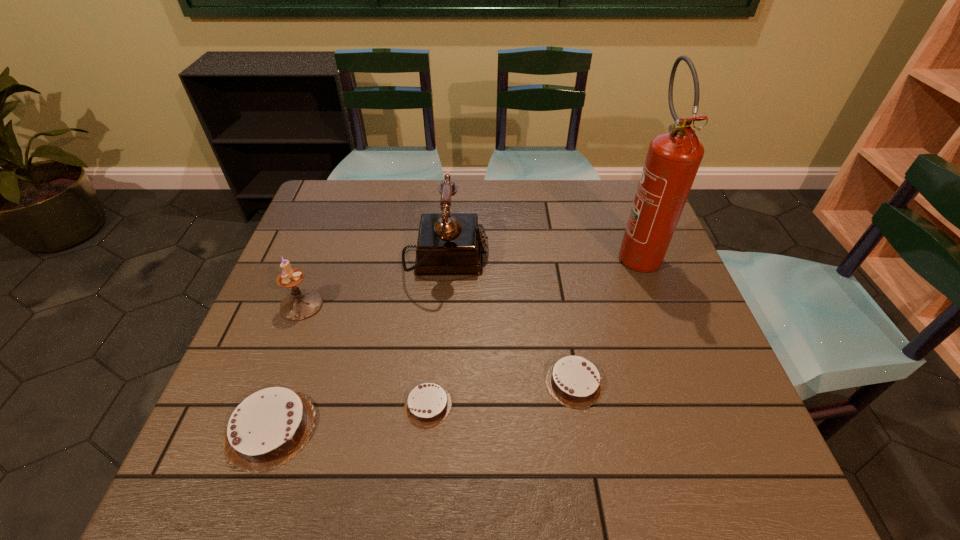
Identify the location of the leftmost chocolate cake. The width and height of the screenshot is (960, 540). (269, 427).

Locate an element on the screen. The width and height of the screenshot is (960, 540). the fourth tallest object is located at coordinates (269, 427).

At what (x,y) coordinates should I click in order to perform the action: click on the shortest chocolate cake. Please return your answer as a coordinate pair (x, y). Looking at the image, I should click on (428, 404).

You are a GUI agent. You are given a task and a screenshot of the screen. Output one action in this format:
    pyautogui.click(x=<x>, y=<y>)
    Task: Click on the shortest object
    The image size is (960, 540).
    Given the screenshot: What is the action you would take?
    pyautogui.click(x=428, y=404)

Where is `the fifth object from left to right`? Image resolution: width=960 pixels, height=540 pixels. the fifth object from left to right is located at coordinates (573, 381).

You are a GUI agent. You are given a task and a screenshot of the screen. Output one action in this format:
    pyautogui.click(x=<x>, y=<y>)
    Task: Click on the rightmost chocolate cake
    This screenshot has height=540, width=960.
    Given the screenshot: What is the action you would take?
    pyautogui.click(x=573, y=381)

The width and height of the screenshot is (960, 540). What are the coordinates of `telephone` in the screenshot? It's located at click(x=448, y=243).

Image resolution: width=960 pixels, height=540 pixels. Find the location of `the tallest object`. the tallest object is located at coordinates [673, 159].

Where is `fire extinguisher`? fire extinguisher is located at coordinates (673, 159).

The height and width of the screenshot is (540, 960). In order to click on candle holder in this screenshot , I will do click(x=300, y=304).